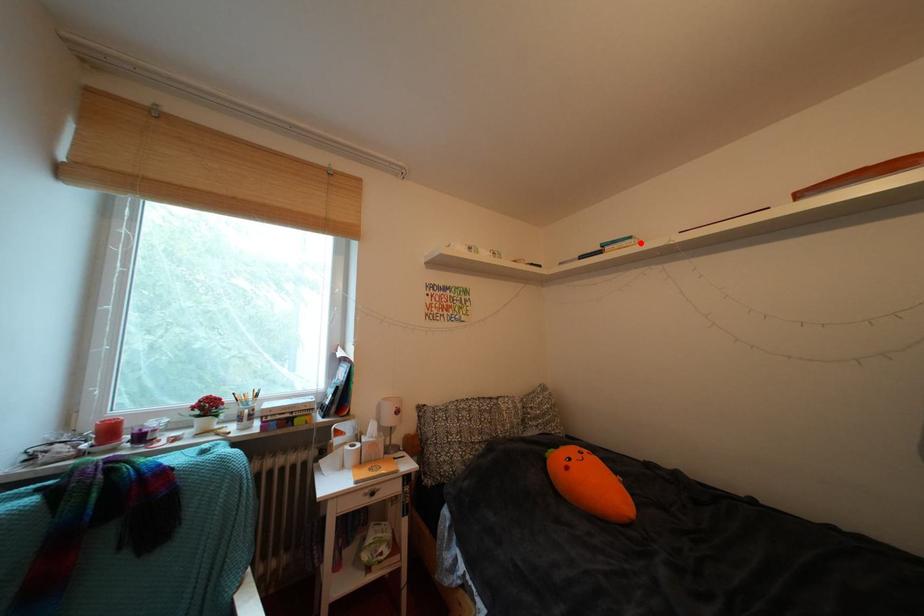
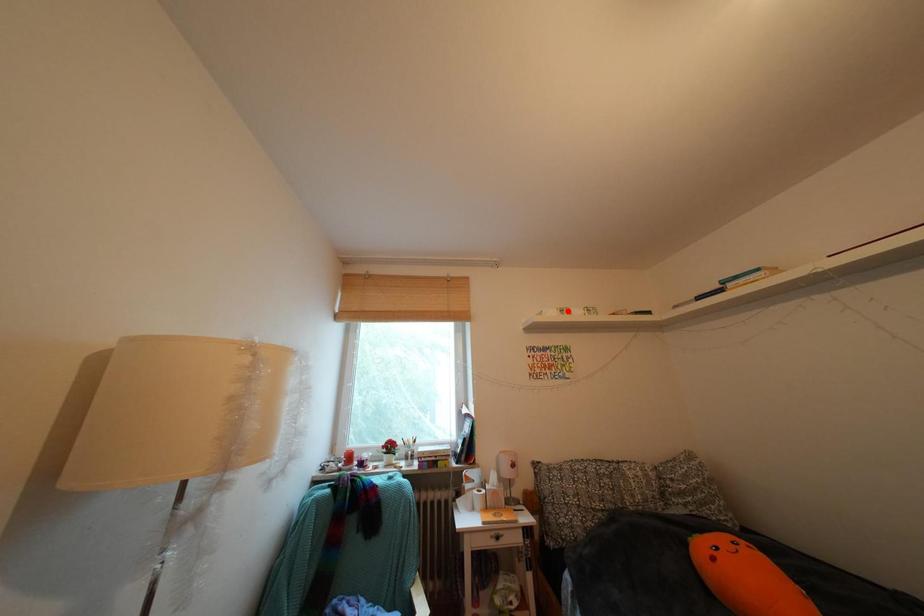
I am providing you with two images of the same scene from different viewpoints. A red point is marked on the first image and another point is marked on the second image. Are the points marked in image1 and image2 representing the same 3D position?

No